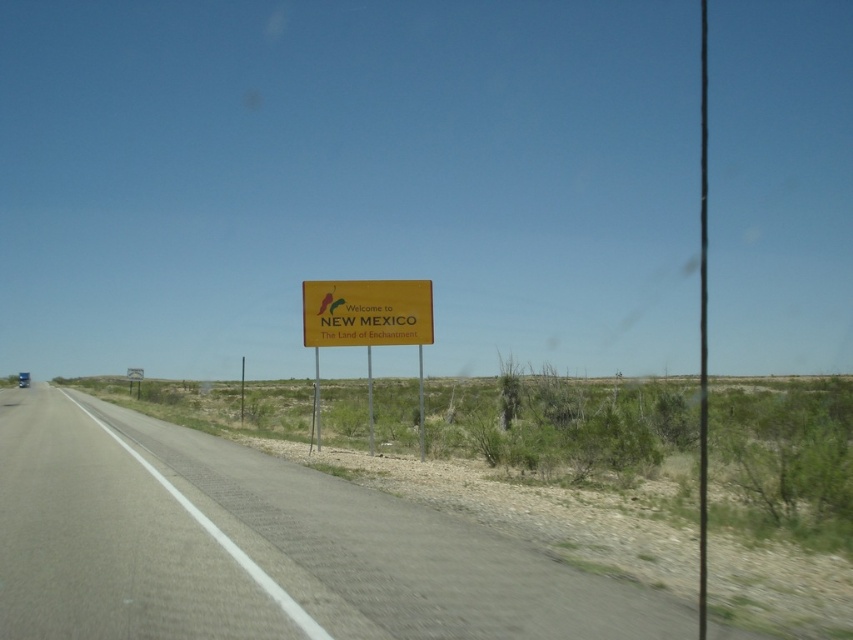
Question: Which of the following is the farthest from the observer?

Choices:
 (A) (9, 611)
 (B) (341, 326)

Answer: (B)

Question: Among these points, which one is farthest from the camera?

Choices:
 (A) (368, 321)
 (B) (312, 625)

Answer: (A)

Question: Does gray asphalt road at center have a lesser width compared to yellow matte sign at center?

Choices:
 (A) yes
 (B) no

Answer: (B)

Question: Can you confirm if gray asphalt road at center is smaller than yellow matte sign at center?

Choices:
 (A) no
 (B) yes

Answer: (A)

Question: Is gray asphalt road at center below yellow matte sign at center?

Choices:
 (A) yes
 (B) no

Answer: (A)